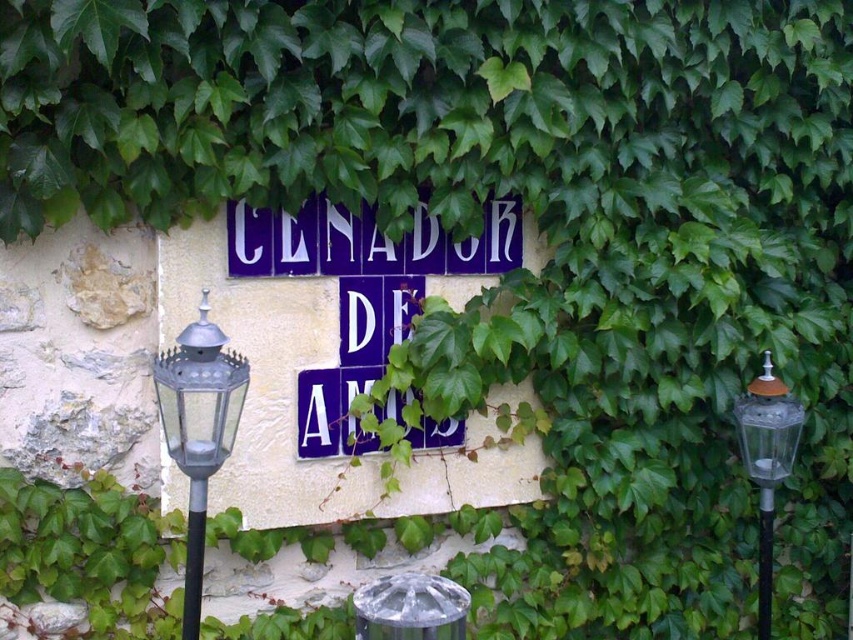
Question: Is clear glass lamp post at right to the left of metallic glass pole at right from the viewer's perspective?

Choices:
 (A) no
 (B) yes

Answer: (B)

Question: Does metallic glass at left have a larger size compared to black matte pole at left?

Choices:
 (A) yes
 (B) no

Answer: (A)

Question: Which object is positioned closest to the metallic glass pole at right?

Choices:
 (A) metallic glass at left
 (B) clear glass lamp post at right

Answer: (B)

Question: Does metallic glass at left come in front of clear glass lamp post at right?

Choices:
 (A) no
 (B) yes

Answer: (B)

Question: Which point appears closest to the camera in this image?

Choices:
 (A) (743, 461)
 (B) (195, 586)

Answer: (B)

Question: Which point is farther to the camera?

Choices:
 (A) black matte pole at left
 (B) metallic glass pole at right
 (C) clear glass lamp post at right
 (D) metallic glass at left

Answer: (B)